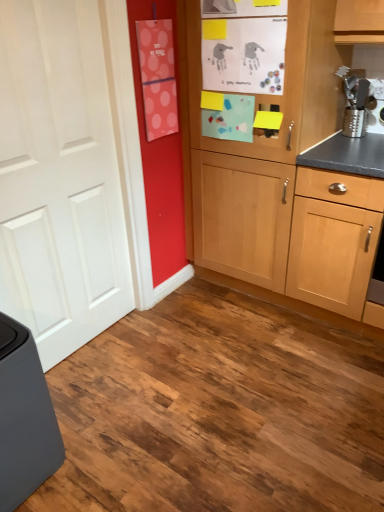
Find the location of a particular element. The width and height of the screenshot is (384, 512). free space behind matte gray trash can at lower left is located at coordinates (79, 392).